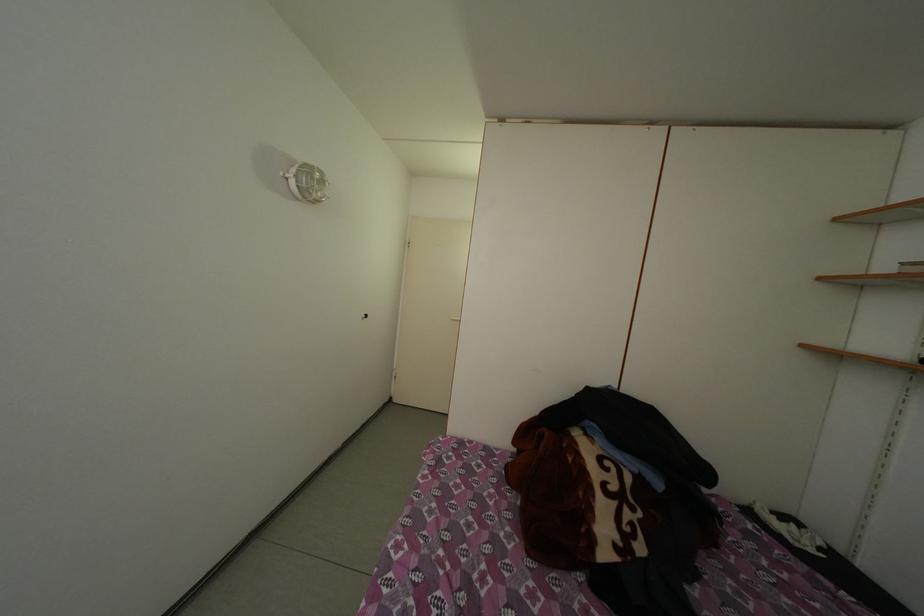
The height and width of the screenshot is (616, 924). In order to click on white door handle in this screenshot , I will do `click(455, 318)`.